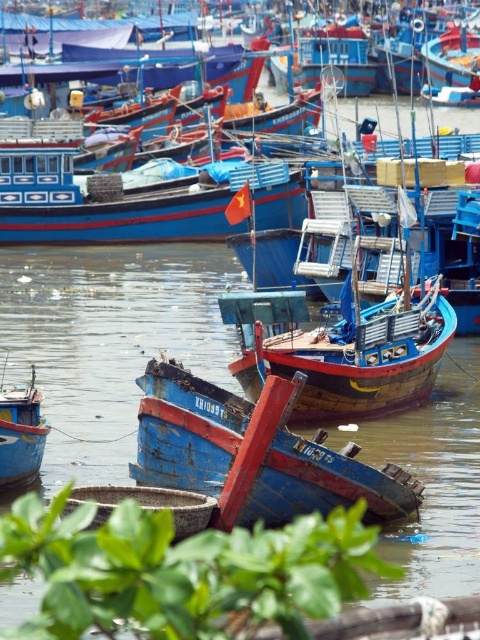
Between blue wooden boat at center and blue wooden boat at lower left, which one appears on the right side from the viewer's perspective?

blue wooden boat at center is more to the right.

Does blue wooden boat at center have a greater width compared to blue wooden boat at lower left?

Indeed, blue wooden boat at center has a greater width compared to blue wooden boat at lower left.

Between point (170, 472) and point (34, 476), which one is positioned in front?

Point (170, 472) is in front.

Identify the location of blue wooden boat at center. The width and height of the screenshot is (480, 640). pyautogui.click(x=187, y=429).